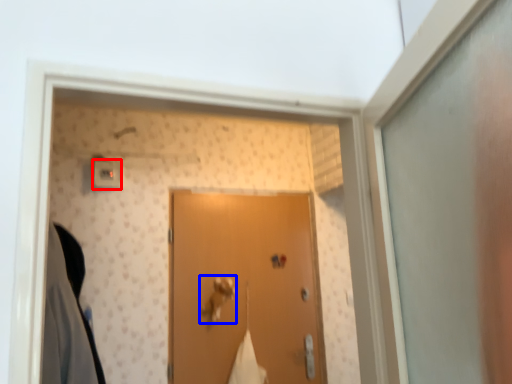
Question: Which of the following is the farthest to the observer, light switch (highlighted by a red box) or door handle (highlighted by a blue box)?

Choices:
 (A) light switch
 (B) door handle

Answer: (B)